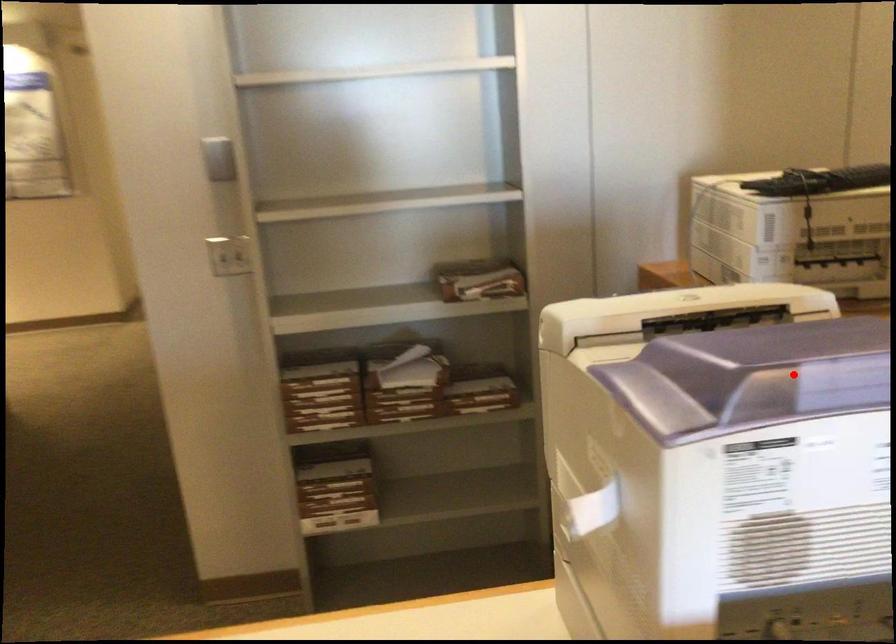
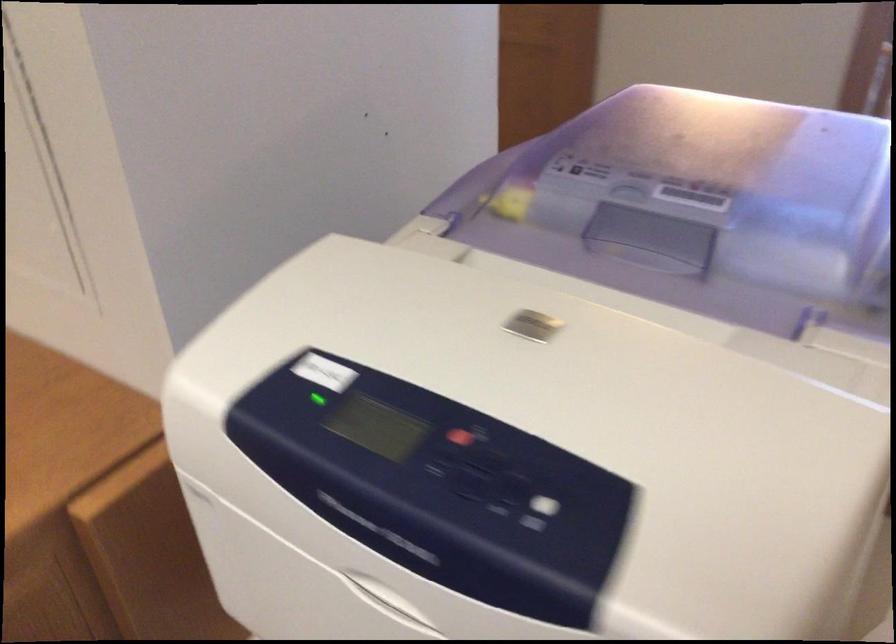
Locate, in the second image, the point that corresponds to the highlighted location in the first image.

(656, 234)